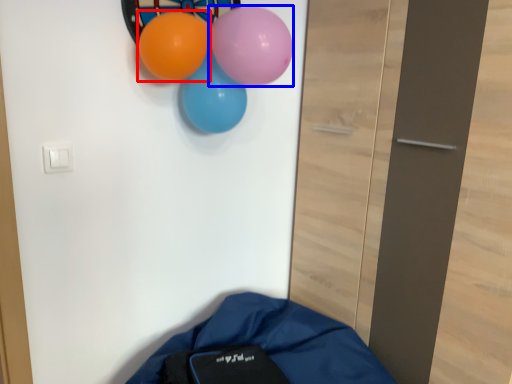
Question: Which of the following is the closest to the observer, balloon (highlighted by a red box) or balloon (highlighted by a blue box)?

Choices:
 (A) balloon
 (B) balloon

Answer: (B)